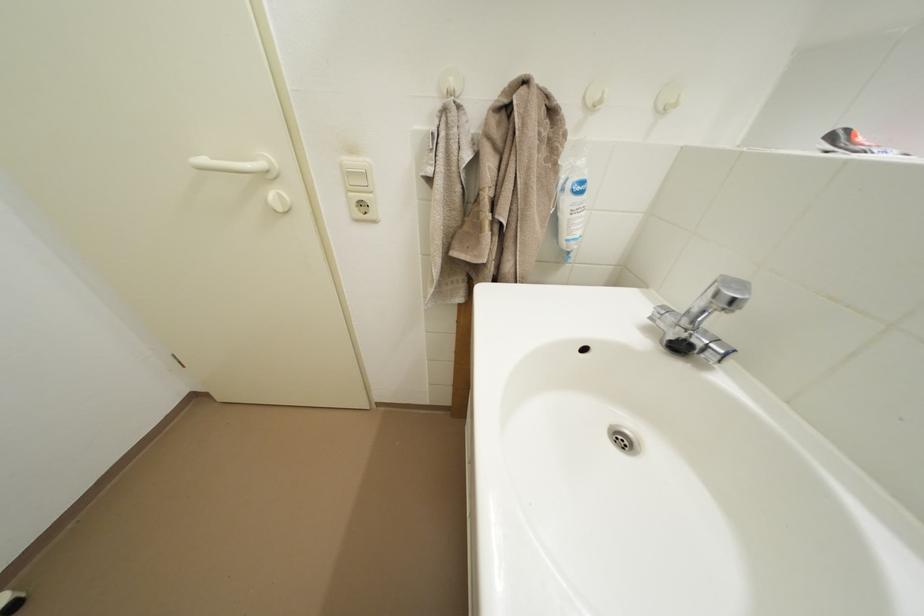
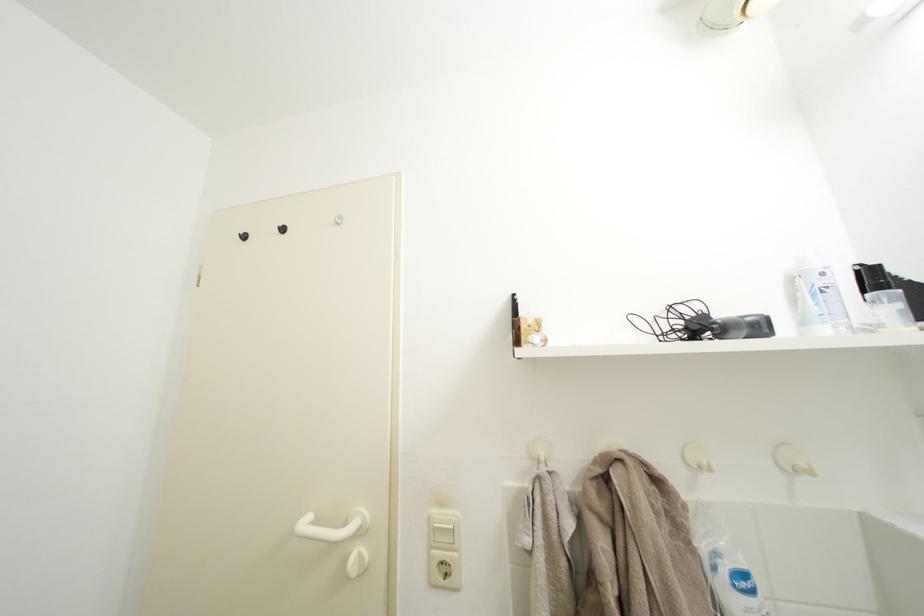
The point at (593,103) is marked in the first image. Where is the corresponding point in the second image?

(694, 464)